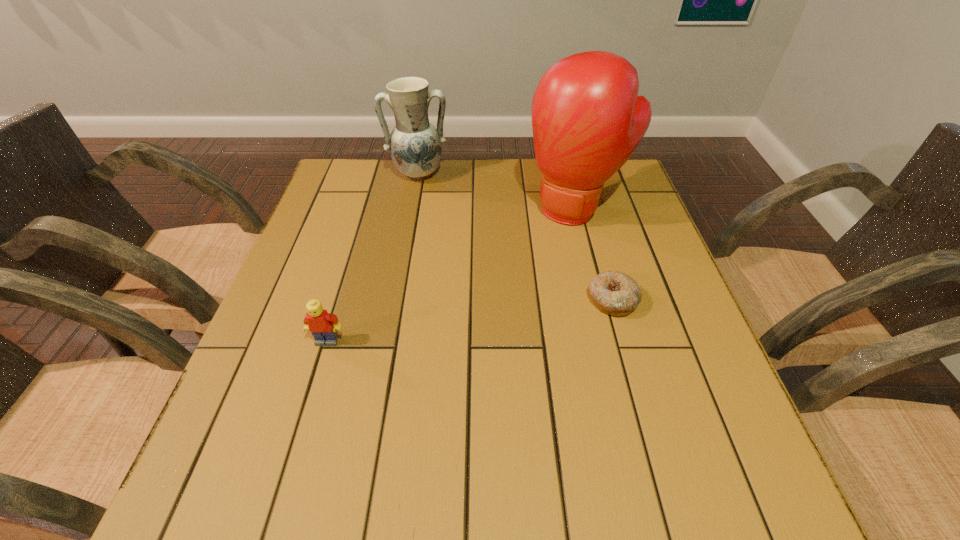
I want to click on free space on the desktop that is between the third tallest object and the doughnut and is positioned on the striking surface of the boxing glove, so click(x=510, y=314).

The width and height of the screenshot is (960, 540). In order to click on vacant space on the desktop that is between the third tallest object and the doughnut and is positioned on either side of the pottery in this screenshot , I will do `click(437, 325)`.